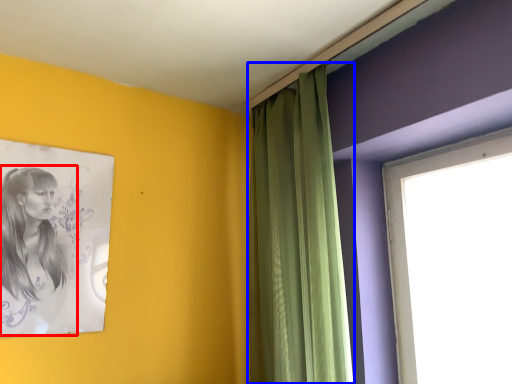
Question: Which object is closer to the camera taking this photo, woman (highlighted by a red box) or curtain (highlighted by a blue box)?

Choices:
 (A) woman
 (B) curtain

Answer: (B)